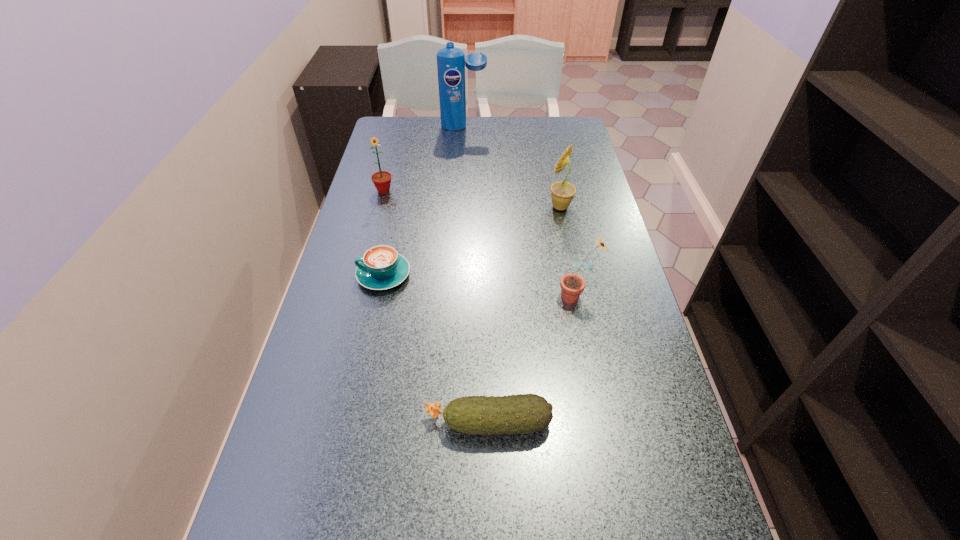
The width and height of the screenshot is (960, 540). What are the coordinates of `sunflower situated at the left edge` in the screenshot? It's located at (382, 179).

Find the location of a particular element. The image size is (960, 540). cappuccino that is positioned at the left edge is located at coordinates (381, 267).

In the image, there is a desktop. Where is `vacant space at the far edge`? The image size is (960, 540). vacant space at the far edge is located at coordinates click(512, 123).

The height and width of the screenshot is (540, 960). I want to click on vacant space at the left edge of the desktop, so 413,150.

Where is `vacant space at the right edge`? Image resolution: width=960 pixels, height=540 pixels. vacant space at the right edge is located at coordinates (631, 332).

At what (x,y) coordinates should I click in order to perform the action: click on free space at the far left corner of the desktop. Please return your answer as a coordinate pair (x, y). Image resolution: width=960 pixels, height=540 pixels. Looking at the image, I should click on (384, 128).

The image size is (960, 540). I want to click on free spot between the farthest object and the nearest sunflower, so click(520, 212).

Identify the location of vacant point located between the nearest object and the cappuccino. (436, 349).

This screenshot has width=960, height=540. I want to click on free point between the fourth nearest object and the cucumber, so click(524, 315).

Locate an element on the screen. This screenshot has height=540, width=960. vacant space that's between the cucumber and the fifth nearest object is located at coordinates (436, 307).